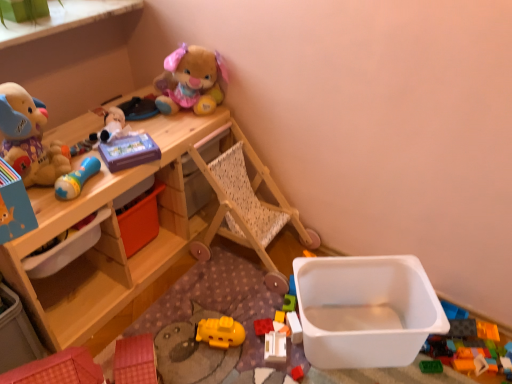
You are a GUI agent. You are given a task and a screenshot of the screen. Output one action in this format:
    pyautogui.click(x=<x>, y=<y>)
    Task: Click on the vacant area that is in front of fluffy plush rabbit at upper center, the 1th toy viewed from the top
    Image resolution: width=512 pixels, height=384 pixels.
    Given the screenshot: What is the action you would take?
    pyautogui.click(x=178, y=129)